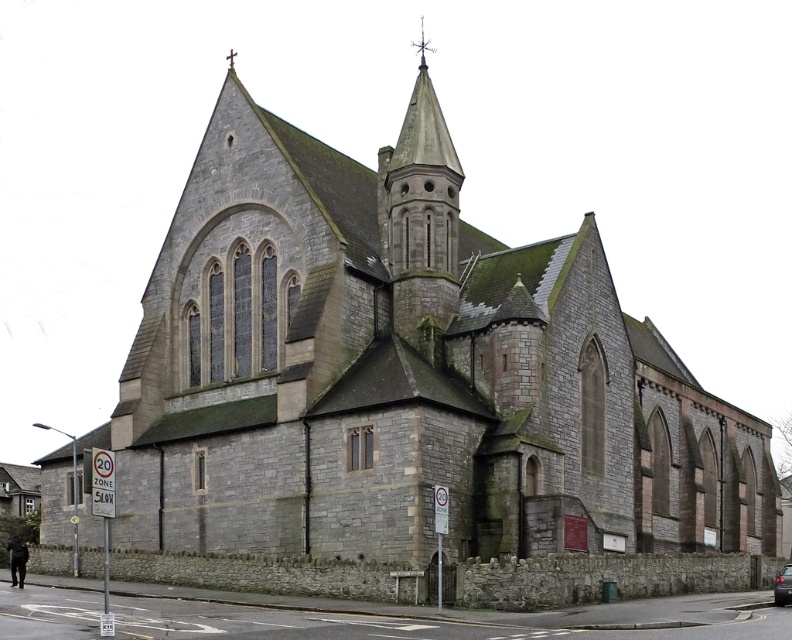
Which of these two, dark gray stone spire at center or metallic silver car at lower right, stands taller?

Standing taller between the two is dark gray stone spire at center.

Which of these two, dark gray stone spire at center or metallic silver car at lower right, stands shorter?

Standing shorter between the two is metallic silver car at lower right.

Who is more forward, (417, 189) or (775, 586)?

Point (417, 189)

Identify the location of dark gray stone spire at center. (421, 220).